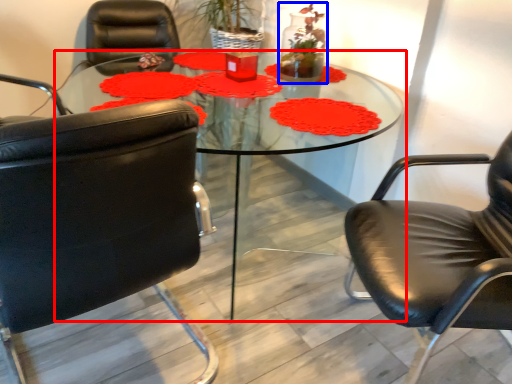
Question: Which of the following is the closest to the observer, coffee table (highlighted by a red box) or floral arrangement (highlighted by a blue box)?

Choices:
 (A) coffee table
 (B) floral arrangement

Answer: (A)